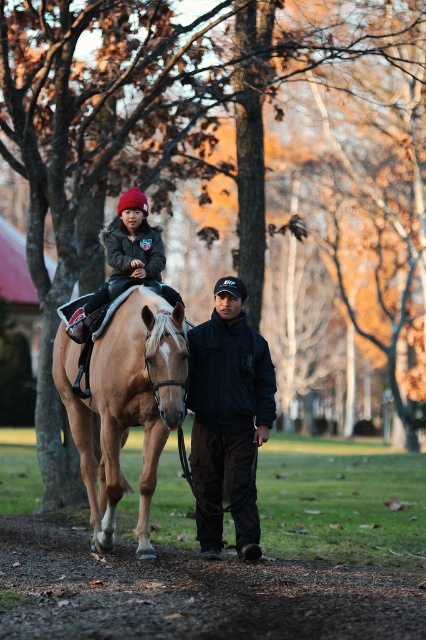
Question: Is light brown leather horse at center positioned behind dark gray fleece jacket at upper left?

Choices:
 (A) no
 (B) yes

Answer: (A)

Question: Considering the real-world distances, which object is closest to the dark gray fleece jacket at upper left?

Choices:
 (A) light brown leather horse at center
 (B) black matte jacket at center

Answer: (A)

Question: Which object is farther from the camera taking this photo?

Choices:
 (A) black matte jacket at center
 (B) dark gray fleece jacket at upper left
 (C) light brown leather horse at center

Answer: (A)

Question: Is light brown leather horse at center positioned in front of dark gray fleece jacket at upper left?

Choices:
 (A) yes
 (B) no

Answer: (A)

Question: Does black matte jacket at center appear over dark gray fleece jacket at upper left?

Choices:
 (A) yes
 (B) no

Answer: (B)

Question: Which point appears closest to the camera in this image?

Choices:
 (A) (115, 234)
 (B) (69, 385)

Answer: (A)